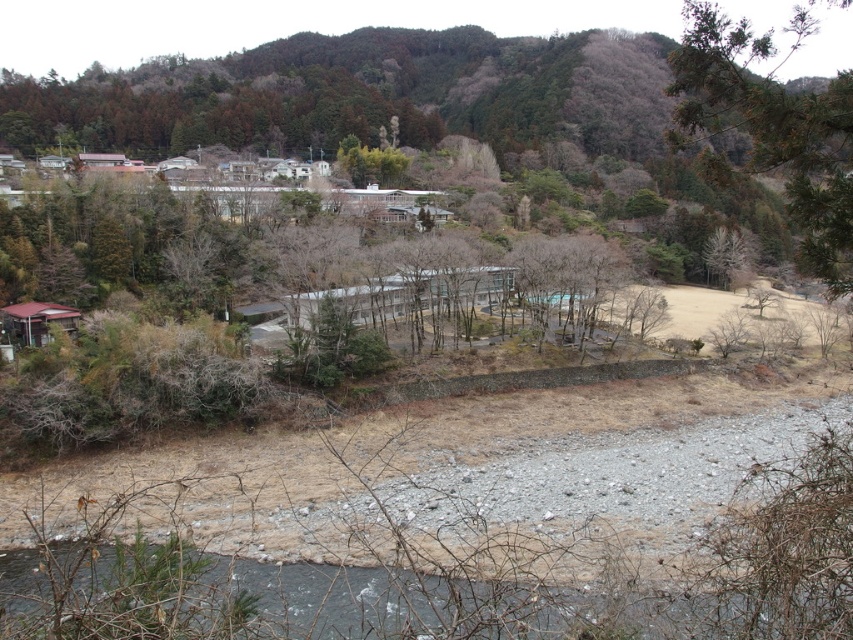
Which of these two, gray gravel river at lower center or green textured pine branch at upper right, stands shorter?

gray gravel river at lower center is shorter.

Is point (228, 572) less distant than point (808, 237)?

No, it is behind (808, 237).

Identify the location of gray gravel river at lower center. The height and width of the screenshot is (640, 853). (358, 600).

Which is more to the left, green textured pine branch at upper right or green leafy tree at center?

green leafy tree at center

Is green textured pine branch at upper right wider than green leafy tree at center?

Yes.

What are the coordinates of `green textured pine branch at upper right` in the screenshot? It's located at (772, 131).

Can you confirm if gray gravel river at lower center is bigger than green leafy tree at center?

Incorrect, gray gravel river at lower center is not larger than green leafy tree at center.

Does gray gravel river at lower center have a greater height compared to green leafy tree at center?

In fact, gray gravel river at lower center may be shorter than green leafy tree at center.

Image resolution: width=853 pixels, height=640 pixels. What do you see at coordinates (358, 600) in the screenshot? I see `gray gravel river at lower center` at bounding box center [358, 600].

Locate an element on the screen. gray gravel river at lower center is located at coordinates (358, 600).